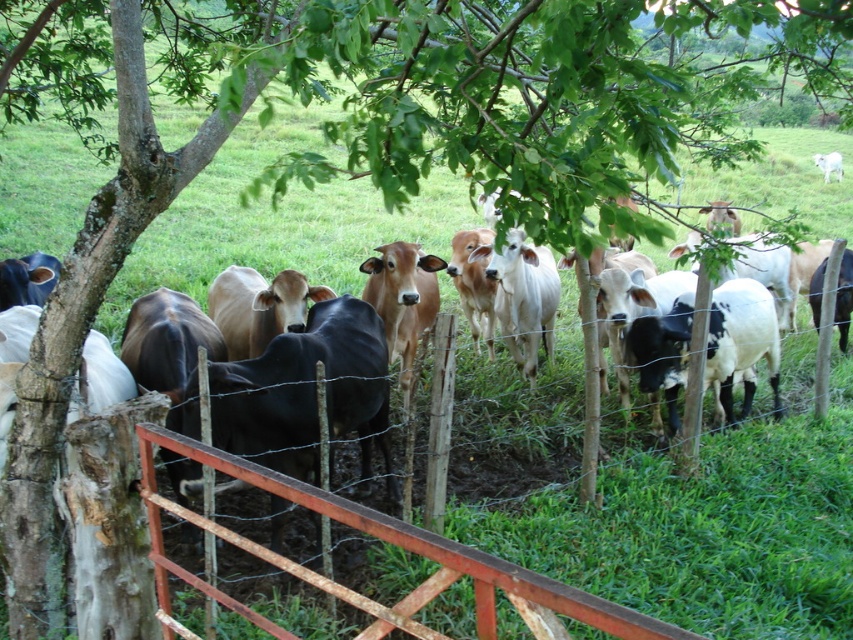
You are a farmer checking the height of your cows. You see the black and white spotted cow at center and the white glossy cow at upper right. Which cow is taller?

The black and white spotted cow at center is much taller than the white glossy cow at upper right.

You are a farmer checking the size of your cows. You see the black and white spotted cow at center and the white glossy cow at upper right. Which cow is larger?

The black and white spotted cow at center is bigger than the white glossy cow at upper right.

You are standing in the middle of a field and see the black and white spotted cow at center. Where is the cow located in relation to you?

The black and white spotted cow at center is located at point 0.536 on the x axis and 0.870 on the y axis.